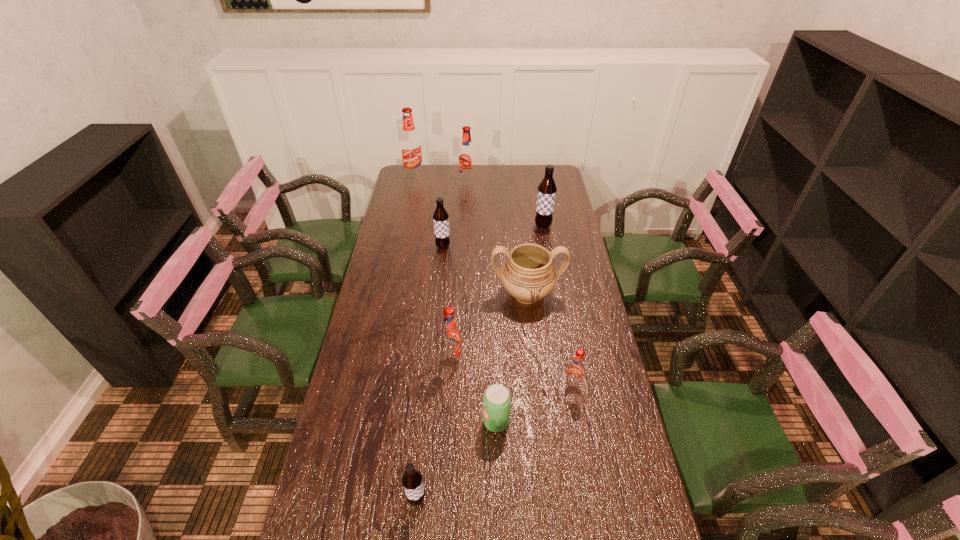
The image size is (960, 540). I want to click on vacant area at the right edge, so click(x=561, y=197).

In the image, there is a desktop. Where is `free space at the far right corner`? Image resolution: width=960 pixels, height=540 pixels. free space at the far right corner is located at coordinates (560, 170).

Locate an element on the screen. The image size is (960, 540). vacant area that lies between the third biggest red root beer and the seventh nearest object is located at coordinates (497, 293).

Locate an element on the screen. Image resolution: width=960 pixels, height=540 pixels. vacant space in between the biggest red root beer and the sixth farthest root beer is located at coordinates (493, 282).

Where is `unoccupied position between the rightmost brown root beer and the sixth farthest root beer`? The height and width of the screenshot is (540, 960). unoccupied position between the rightmost brown root beer and the sixth farthest root beer is located at coordinates (558, 307).

This screenshot has width=960, height=540. Identify the location of vacant area that lies between the eighth farthest object and the nearest brown root beer. (456, 460).

Find the location of `free space between the fifth farthest object and the shortest object`. free space between the fifth farthest object and the shortest object is located at coordinates (512, 358).

The height and width of the screenshot is (540, 960). Find the location of `free space between the fifth nearest root beer and the sixth nearest object`. free space between the fifth nearest root beer and the sixth nearest object is located at coordinates (493, 236).

In order to click on vacant area that lies between the fourth nearest object and the nearest object in this screenshot , I will do `click(435, 429)`.

The image size is (960, 540). I want to click on vacant space that is in between the second smallest brown root beer and the tallest root beer, so click(x=428, y=211).